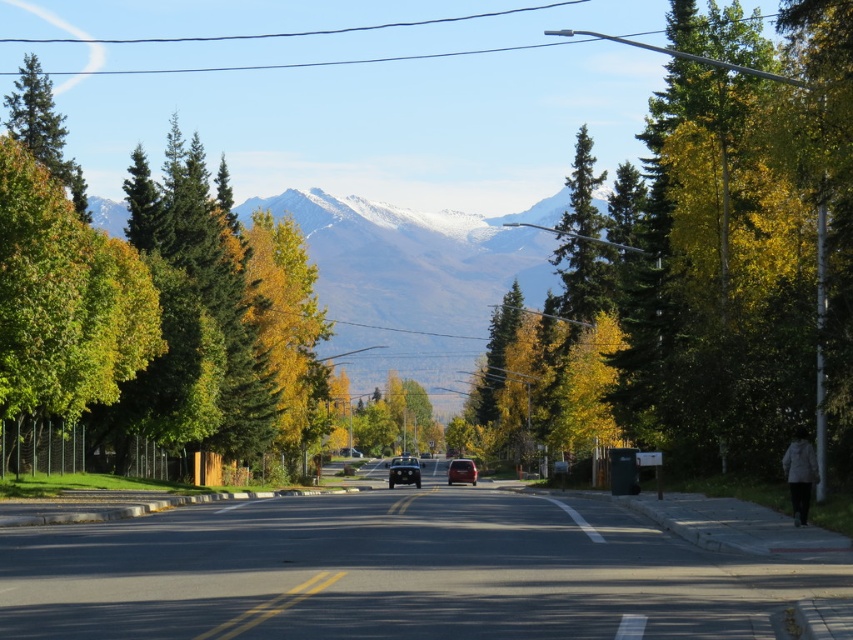
Question: Which point appears closest to the camera in this image?

Choices:
 (A) (729, 241)
 (B) (22, 275)
 (C) (461, 458)
 (D) (35, 125)

Answer: (B)

Question: Does metallic silver van at center have a larger size compared to yellow asphalt road at center?

Choices:
 (A) no
 (B) yes

Answer: (B)

Question: Is yellow-green foliage at center below shiny black car at center?

Choices:
 (A) yes
 (B) no

Answer: (B)

Question: Which object is the closest to the yellow/golden leaves at center?

Choices:
 (A) green matte tree at upper left
 (B) shiny black car at center
 (C) snowy granite mountain range at center
 (D) yellow-green foliage at center

Answer: (B)

Question: Is yellow-green foliage at center below shiny black car at center?

Choices:
 (A) no
 (B) yes

Answer: (A)

Question: Among these objects, which one is farthest from the camera?

Choices:
 (A) metallic silver van at center
 (B) yellow/golden leaves at center

Answer: (B)